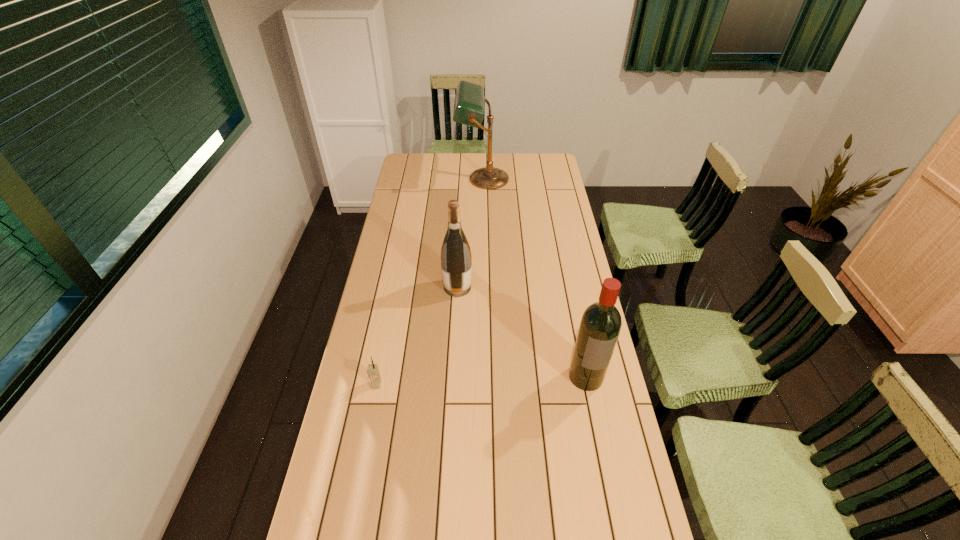
The image size is (960, 540). What are the coordinates of `free space located on the label of the rightmost object` in the screenshot? It's located at (602, 455).

You are a GUI agent. You are given a task and a screenshot of the screen. Output one action in this format:
    pyautogui.click(x=<x>, y=<y>)
    Task: Click on the vacant area situated on the label of the farther wine bottle
    This screenshot has width=960, height=540.
    Given the screenshot: What is the action you would take?
    pyautogui.click(x=575, y=287)

This screenshot has height=540, width=960. Identify the location of free space located on the front of the leftmost object, where the keypad is located. (359, 473).

Identify the location of object that is at the far edge. (469, 99).

Locate an element on the screen. This screenshot has width=960, height=540. object that is positioned at the left edge is located at coordinates (372, 370).

Identify the location of object positioned at the right edge. This screenshot has width=960, height=540. [x=600, y=326].

Find the location of `free space at the far edge of the desktop`. free space at the far edge of the desktop is located at coordinates (471, 172).

Find the location of a particular element. The width and height of the screenshot is (960, 540). blank space at the left edge of the desktop is located at coordinates [362, 534].

This screenshot has height=540, width=960. Identify the location of vacant space at the right edge. (620, 458).

Identify the location of vacant space at the far right corner of the desktop. The height and width of the screenshot is (540, 960). (534, 170).